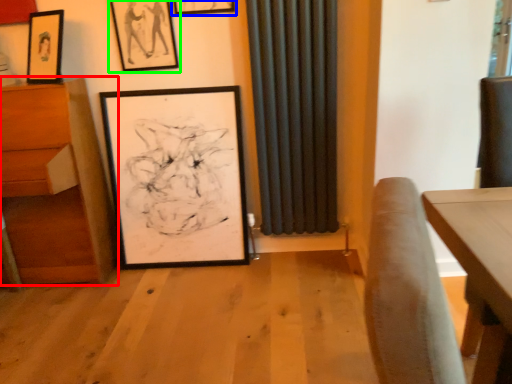
Question: Considering the real-world distances, which object is closest to furniture (highlighted by a red box)? picture frame (highlighted by a blue box) or picture frame (highlighted by a green box).

Choices:
 (A) picture frame
 (B) picture frame

Answer: (B)